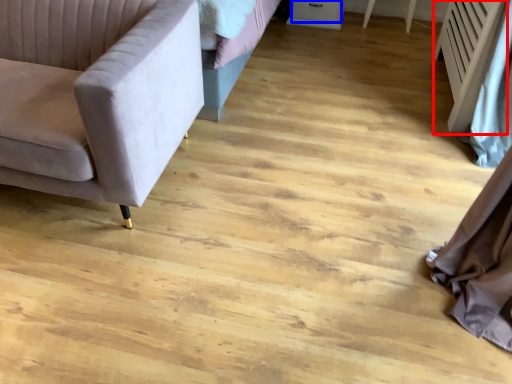
Question: Which object appears closest to the camera in this image, radiator (highlighted by a red box) or drawer (highlighted by a blue box)?

Choices:
 (A) radiator
 (B) drawer

Answer: (A)